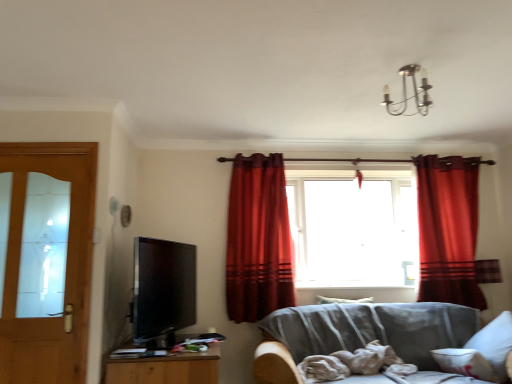
Question: Considering the relative sizes of gray fabric couch at lower right and white soft pillow at lower right, which appears as the 1th pillow when ordered from the bottom, in the image provided, is gray fabric couch at lower right smaller than white soft pillow at lower right, which appears as the 1th pillow when ordered from the bottom,?

Choices:
 (A) yes
 (B) no

Answer: (B)

Question: From the image's perspective, is gray fabric couch at lower right beneath white soft pillow at lower right, the second pillow viewed from the back?

Choices:
 (A) yes
 (B) no

Answer: (A)

Question: Considering the relative sizes of gray fabric couch at lower right and white soft pillow at lower right, which appears as the 1th pillow when ordered from the bottom, in the image provided, is gray fabric couch at lower right bigger than white soft pillow at lower right, which appears as the 1th pillow when ordered from the bottom,?

Choices:
 (A) yes
 (B) no

Answer: (A)

Question: Is gray fabric couch at lower right taller than white soft pillow at lower right, which appears as the 1th pillow when ordered from the bottom?

Choices:
 (A) no
 (B) yes

Answer: (B)

Question: Is gray fabric couch at lower right placed right next to white soft pillow at lower right, which appears as the 1th pillow when ordered from the bottom?

Choices:
 (A) no
 (B) yes

Answer: (A)

Question: Considering the relative positions of gray fabric couch at lower right and white soft pillow at lower right, the second pillow viewed from the back, in the image provided, is gray fabric couch at lower right in front of white soft pillow at lower right, the second pillow viewed from the back,?

Choices:
 (A) no
 (B) yes

Answer: (B)

Question: From a real-world perspective, is light brown wooden door at left positioned under velvet red curtain at center, the 2th curtain from the right, based on gravity?

Choices:
 (A) no
 (B) yes

Answer: (B)

Question: Is light brown wooden door at left shorter than velvet red curtain at center, the 2th curtain from the right?

Choices:
 (A) yes
 (B) no

Answer: (A)

Question: From the image's perspective, is light brown wooden door at left over velvet red curtain at center, positioned as the 1th curtain in left-to-right order?

Choices:
 (A) yes
 (B) no

Answer: (B)

Question: Considering the relative sizes of light brown wooden door at left and velvet red curtain at center, the 2th curtain from the right, in the image provided, is light brown wooden door at left taller than velvet red curtain at center, the 2th curtain from the right,?

Choices:
 (A) yes
 (B) no

Answer: (B)

Question: Can you confirm if light brown wooden door at left is positioned to the right of velvet red curtain at center, positioned as the 1th curtain in left-to-right order?

Choices:
 (A) no
 (B) yes

Answer: (A)

Question: Is light brown wooden door at left not inside velvet red curtain at center, positioned as the 1th curtain in left-to-right order?

Choices:
 (A) no
 (B) yes

Answer: (B)

Question: From the image's perspective, is transparent glass window at center under satin red curtain at right, placed as the second curtain when sorted from left to right?

Choices:
 (A) yes
 (B) no

Answer: (B)